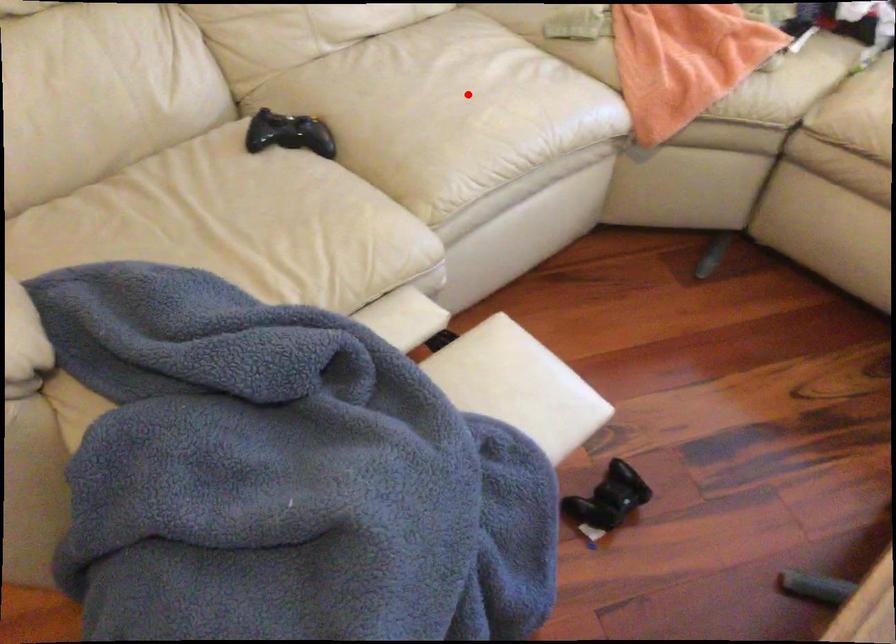
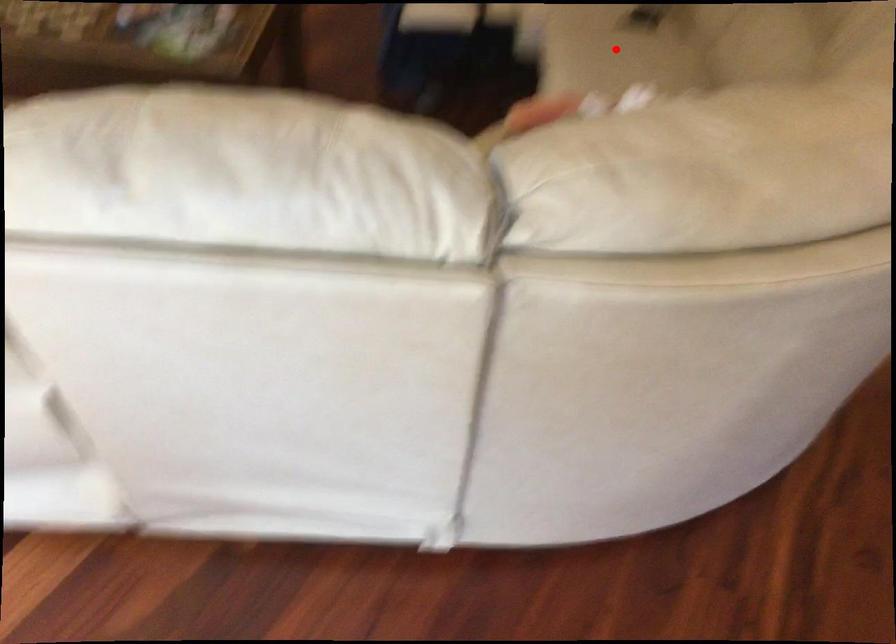
I am providing you with two images of the same scene from different viewpoints. A red point is marked on the first image and another point is marked on the second image. Do the highlighted points in image1 and image2 indicate the same real-world spot?

Yes